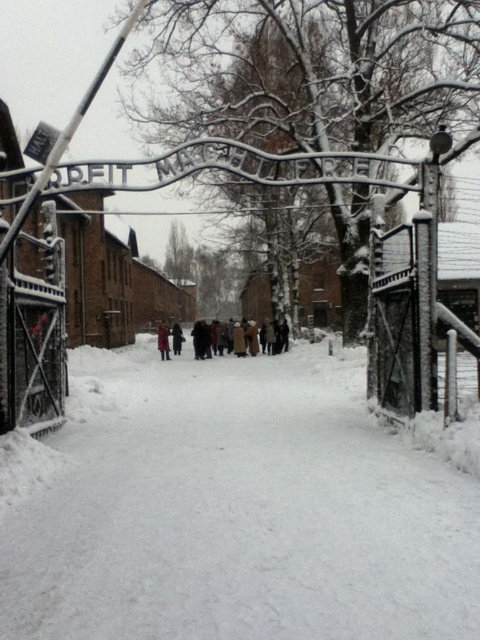
Looking at this image, you are standing at the entrance gate of Auschwitz Birkenau and see two points marked on the snow covered ground. The first point is at coordinate point (287, 348) and the second point is at coordinate point (166, 333). Which point is closer to your current position?

Point (166, 333) is closer to your current position because it is closer to the camera than point (287, 348).

You are standing at the entrance gate of Auschwitz Birkenau and see a point marked at coordinates (237,506). According to the image, where is this point located?

The point is located on white powdery snow at center.

From the picture: You are standing at the entrance gate of Auschwitz Birkenau and looking at the snow covered scene. There is a point at coordinate (x=237, y=506). What is located at that point?

The point at coordinate (x=237, y=506) corresponds to white powdery snow at center.